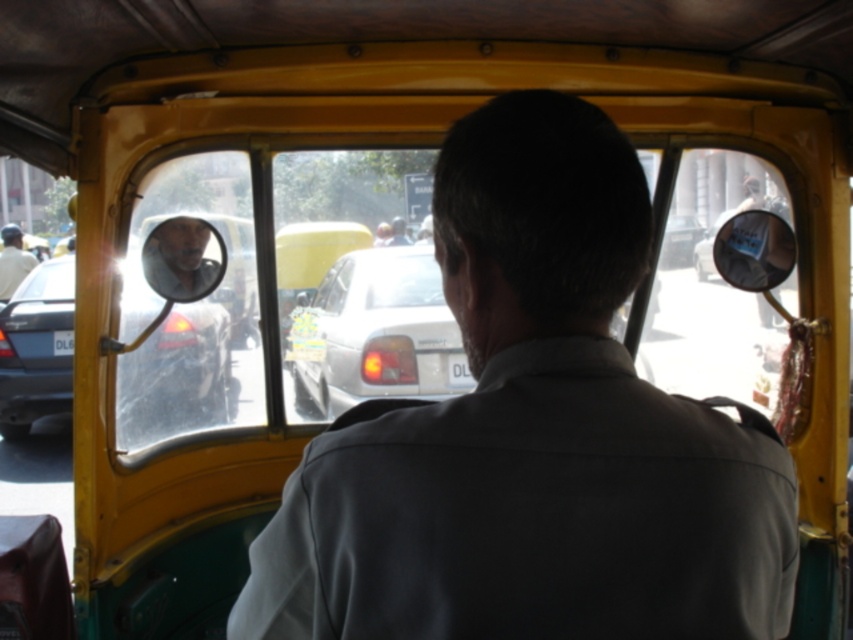
Question: Does gray fabric shirt at center appear over matte black car at left?

Choices:
 (A) no
 (B) yes

Answer: (B)

Question: Among these points, which one is nearest to the camera?

Choices:
 (A) (19, 260)
 (B) (375, 260)

Answer: (B)

Question: Considering the real-world distances, which object is closest to the white plastic license plate at center?

Choices:
 (A) gray fabric shirt at center
 (B) whiteplasticlicense plate at left
 (C) white glossy sedan at center

Answer: (C)

Question: Is light beige shirt at left above whiteplasticlicense plate at left?

Choices:
 (A) yes
 (B) no

Answer: (A)

Question: Which point is farther from the camera taking this photo?

Choices:
 (A) (160, 272)
 (B) (282, 625)
 (C) (679, 257)

Answer: (C)

Question: Is gray fabric shirt at center above white plastic license plate at center?

Choices:
 (A) yes
 (B) no

Answer: (A)